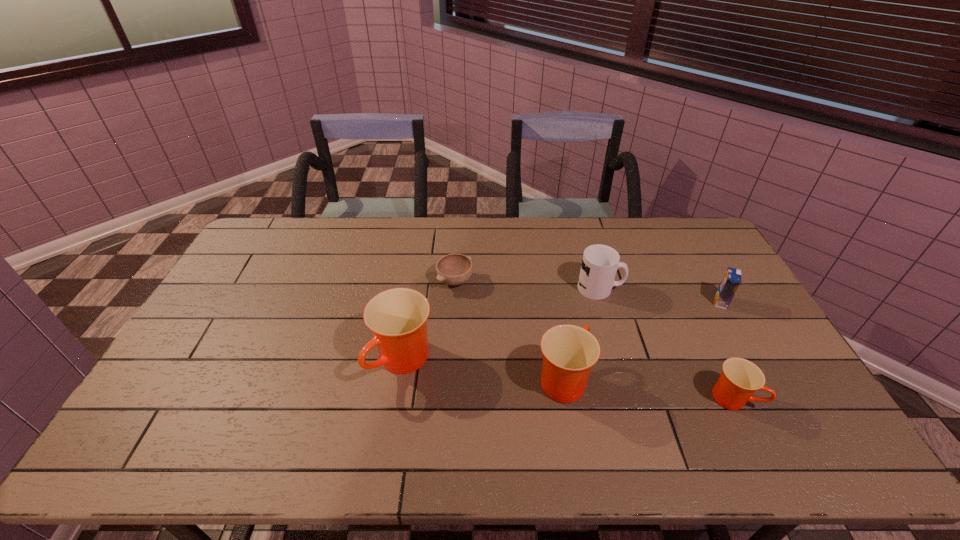
Where is `the leftmost cup`? This screenshot has width=960, height=540. the leftmost cup is located at coordinates (397, 317).

Find the location of a particular element. Image resolution: width=960 pixels, height=540 pixels. the second tallest cup is located at coordinates (569, 352).

Locate an element on the screen. Image resolution: width=960 pixels, height=540 pixels. the third object from left to right is located at coordinates (569, 352).

At what (x,y) coordinates should I click in order to perform the action: click on the fifth object from left to right. Please return your answer as a coordinate pair (x, y). Looking at the image, I should click on (740, 379).

The height and width of the screenshot is (540, 960). What are the coordinates of `the shortest cup` in the screenshot? It's located at (740, 379).

You are a GUI agent. You are given a task and a screenshot of the screen. Output one action in this format:
    pyautogui.click(x=<x>, y=<y>)
    Task: Click on the fourth object from left to right
    The height and width of the screenshot is (540, 960).
    Given the screenshot: What is the action you would take?
    (600, 263)

Locate an element on the screen. the shortest object is located at coordinates (453, 269).

I want to click on orange_juice, so click(x=732, y=278).

Identify the location of vacant space located on the left of the leftmost cup. (312, 361).

Where is `vacant space situated 0.390m on the left of the third object from left to right`? This screenshot has height=540, width=960. vacant space situated 0.390m on the left of the third object from left to right is located at coordinates (391, 379).